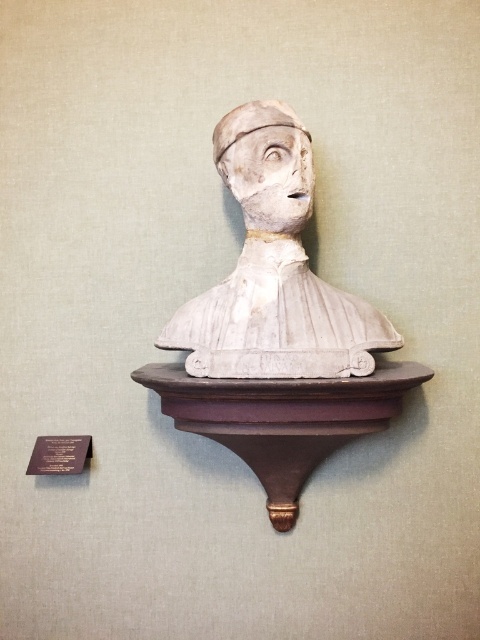
You are an art conservator examining the classical bust sculpture on the dark wooden shelf. You notice two points marked on the wall at coordinates point (283, 160) and point (173, 374). Which point is closer to the viewer?

Point (283, 160) is in front of point (173, 374), so it is closer to the viewer.

You are an art conservator working on a classical bust sculpture. You need to place a protective barrier between the white plaster bust at center and the brown polished wood at center. The barrier must be at least 5 inches thick. Can you safely place the barrier between them?

The distance between the white plaster bust at center and the brown polished wood at center is 5.08 inches. Since the barrier requires at least 5 inches of space, the 5.08 inches is sufficient, so yes, you can safely place the barrier between them.